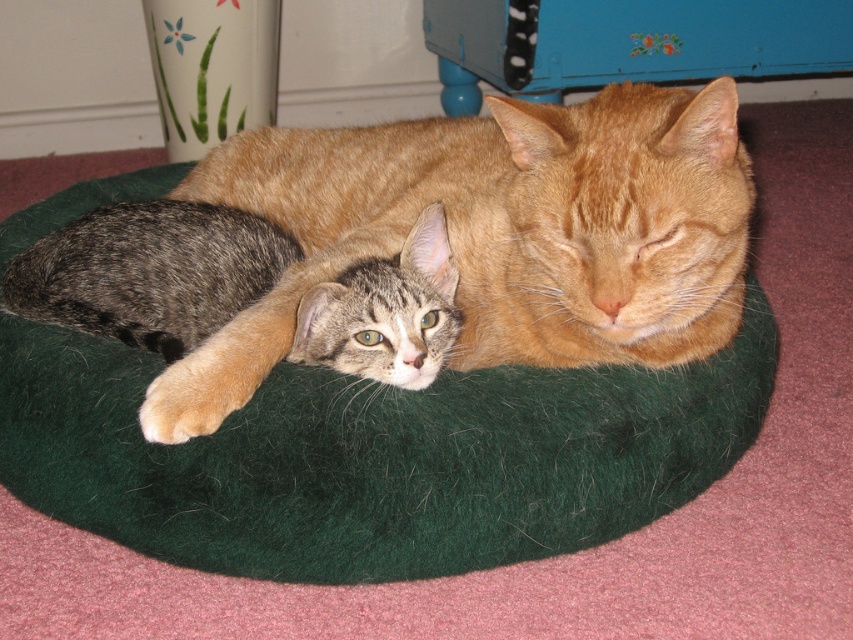
Is green felt cat bed at center shorter than gray tabby kitten at center?

No.

Is green felt cat bed at center positioned behind gray tabby kitten at center?

No.

You are a GUI agent. You are given a task and a screenshot of the screen. Output one action in this format:
    pyautogui.click(x=<x>, y=<y>)
    Task: Click on the green felt cat bed at center
    Image resolution: width=853 pixels, height=640 pixels.
    Given the screenshot: What is the action you would take?
    pyautogui.click(x=374, y=456)

Find the location of a particular element. green felt cat bed at center is located at coordinates (374, 456).